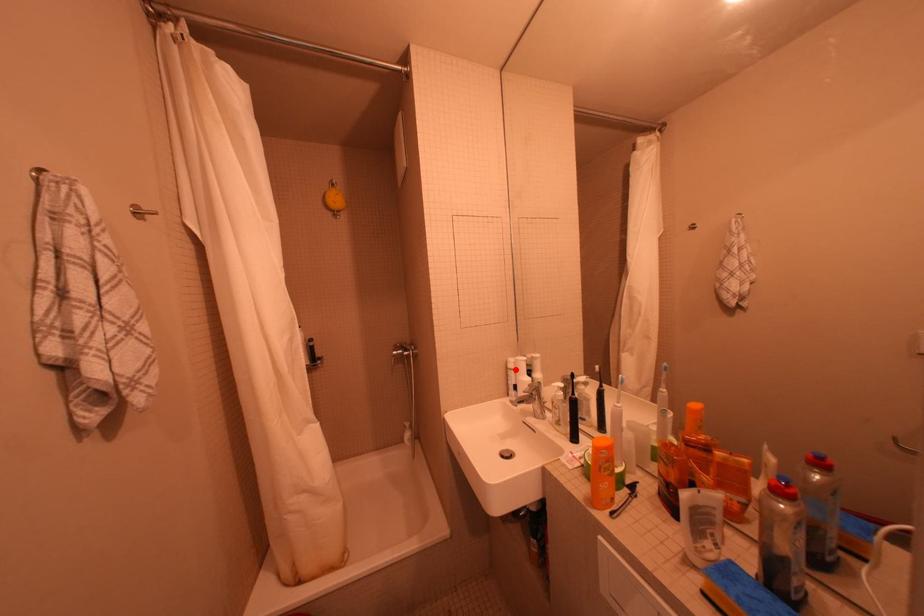
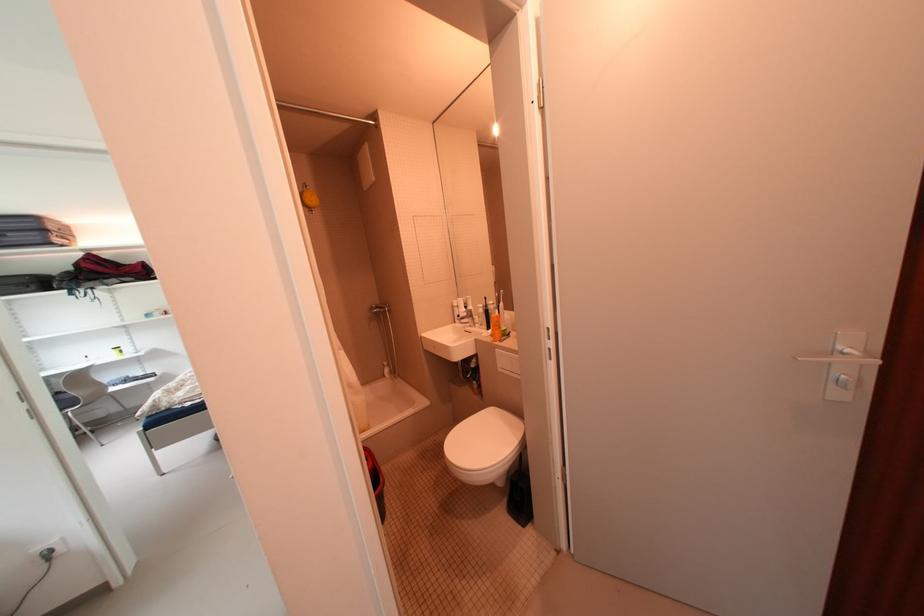
Find the pixel in the second image that matches the highlighted location in the first image.

(460, 308)